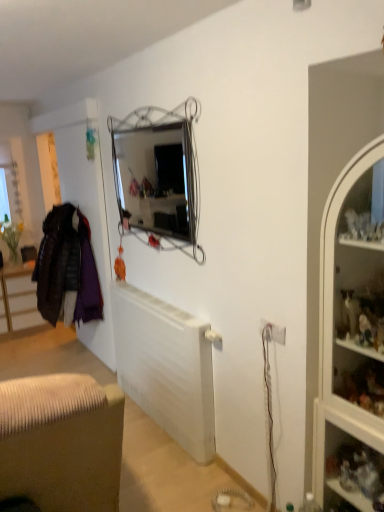
This screenshot has height=512, width=384. What do you see at coordinates (19, 297) in the screenshot?
I see `brown fabric cabinet at lower left` at bounding box center [19, 297].

The image size is (384, 512). What do you see at coordinates (351, 340) in the screenshot?
I see `white glass cabinet at right` at bounding box center [351, 340].

What is the approximate height of velvet purple coat at left?

1.01 meters.

Where is `brown fabric cabinet at lower left`? The height and width of the screenshot is (512, 384). brown fabric cabinet at lower left is located at coordinates click(x=19, y=297).

Is velvet purple coat at left turned away from white matte radiator at center?

No, velvet purple coat at left's orientation is not away from white matte radiator at center.

Does velvet purple coat at left have a greater width compared to white matte radiator at center?

Indeed, velvet purple coat at left has a greater width compared to white matte radiator at center.

Which object is further away from the camera taking this photo, velvet purple coat at left or white matte radiator at center?

velvet purple coat at left.

Where is `radiator directly beneath the velvet purple coat at left (from a real-world perspective)`? The image size is (384, 512). radiator directly beneath the velvet purple coat at left (from a real-world perspective) is located at coordinates (166, 366).

Considering the positions of objects white plastic electric outlet at lower right and clear glass shelves at right in the image provided, who is more to the right, white plastic electric outlet at lower right or clear glass shelves at right?

clear glass shelves at right is more to the right.

From the image's perspective, between white plastic electric outlet at lower right and clear glass shelves at right, who is located below?

clear glass shelves at right is shown below in the image.

Between white plastic electric outlet at lower right and clear glass shelves at right, which one has smaller size?

With smaller size is white plastic electric outlet at lower right.

Is white plastic electric outlet at lower right turned away from white matte radiator at center?

No, white plastic electric outlet at lower right is not facing away from white matte radiator at center.

Is point (266, 339) positioned after point (141, 294)?

No, it is in front of (141, 294).

From the picture: From the image's perspective, would you say white plastic electric outlet at lower right is positioned over white matte radiator at center?

Indeed, from the image's perspective, white plastic electric outlet at lower right is shown above white matte radiator at center.

Would you say white glass cabinet at right is outside clear glass shelves at right?

Yes, white glass cabinet at right is not within clear glass shelves at right.

From a real-world perspective, is white glass cabinet at right physically located above or below clear glass shelves at right?

white glass cabinet at right is above clear glass shelves at right.

Is the position of white glass cabinet at right more distant than that of clear glass shelves at right?

That is False.

Is white glass cabinet at right positioned with its back to clear glass shelves at right?

No, white glass cabinet at right is not facing away from clear glass shelves at right.

From the image's perspective, is clear glass shelves at right on white plastic electric outlet at lower right?

Incorrect, from the image's perspective, clear glass shelves at right is lower than white plastic electric outlet at lower right.

Between clear glass shelves at right and white plastic electric outlet at lower right, which one is positioned in front?

Positioned in front is clear glass shelves at right.

Between clear glass shelves at right and white plastic electric outlet at lower right, which one has smaller width?

Thinner between the two is white plastic electric outlet at lower right.

Which is in front, point (357, 483) or point (269, 327)?

The point (357, 483) is closer.

How different are the orientations of brown fabric cabinet at lower left and white glass cabinet at right in degrees?

The facing directions of brown fabric cabinet at lower left and white glass cabinet at right are 89.4 degrees apart.

From a real-world perspective, is brown fabric cabinet at lower left physically above white glass cabinet at right?

No.

Can you confirm if brown fabric cabinet at lower left is positioned to the right of white glass cabinet at right?

Incorrect, brown fabric cabinet at lower left is not on the right side of white glass cabinet at right.

The height and width of the screenshot is (512, 384). I want to click on cabinetry below the white glass cabinet at right (from the image's perspective), so click(x=19, y=297).

The image size is (384, 512). Identify the location of clothing lying above the white matte radiator at center (from the image's perspective). (67, 268).

Considering the positions of objects white matte radiator at center and velvet purple coat at left in the image provided, who is more to the left, white matte radiator at center or velvet purple coat at left?

Positioned to the left is velvet purple coat at left.

In the scene shown: Is white matte radiator at center far from velvet purple coat at left?

Actually, white matte radiator at center and velvet purple coat at left are a little close together.

From a real-world perspective, is white matte radiator at center positioned above or below velvet purple coat at left?

In terms of real-world spatial position, white matte radiator at center is below velvet purple coat at left.

The height and width of the screenshot is (512, 384). Identify the location of radiator located in front of the velvet purple coat at left. (166, 366).

Where is `electric outlet above the clear glass shelves at right (from a real-world perspective)`? This screenshot has height=512, width=384. electric outlet above the clear glass shelves at right (from a real-world perspective) is located at coordinates (273, 332).

Estimate the real-world distances between objects in this image. Which object is further from white matte radiator at center, velvet purple coat at left or white glass cabinet at right?

white glass cabinet at right.

Consider the image. When comparing their distances from white glass cabinet at right, does white plastic electric outlet at lower right or white matte radiator at center seem further?

The object further to white glass cabinet at right is white matte radiator at center.

Which object lies further to the anchor point white plastic electric outlet at lower right, clear glass shelves at right or white glass cabinet at right?

The object further to white plastic electric outlet at lower right is clear glass shelves at right.

Estimate the real-world distances between objects in this image. Which object is closer to white plastic electric outlet at lower right, brown fabric cabinet at lower left or white matte radiator at center?

white matte radiator at center is closer to white plastic electric outlet at lower right.

Which object lies further to the anchor point brown fabric cabinet at lower left, clear glass shelves at right or white matte radiator at center?

clear glass shelves at right is further to brown fabric cabinet at lower left.

Which object lies nearer to the anchor point white plastic electric outlet at lower right, clear glass shelves at right or velvet purple coat at left?

clear glass shelves at right.

When comparing their distances from clear glass shelves at right, does white matte radiator at center or white glass cabinet at right seem closer?

white glass cabinet at right is closer to clear glass shelves at right.

Which object lies further to the anchor point white plastic electric outlet at lower right, velvet purple coat at left or white matte radiator at center?

Among the two, velvet purple coat at left is located further to white plastic electric outlet at lower right.

Where is `shelf between white glass cabinet at right and brown fabric cabinet at lower left in the front-back direction`? This screenshot has width=384, height=512. shelf between white glass cabinet at right and brown fabric cabinet at lower left in the front-back direction is located at coordinates (351, 473).

Where is `clothing between white plastic electric outlet at lower right and brown fabric cabinet at lower left from front to back`? The width and height of the screenshot is (384, 512). clothing between white plastic electric outlet at lower right and brown fabric cabinet at lower left from front to back is located at coordinates (67, 268).

Identify the location of cabinet between velvet purple coat at left and clear glass shelves at right from left to right. (351, 340).

Image resolution: width=384 pixels, height=512 pixels. In order to click on electric outlet positioned between white glass cabinet at right and brown fabric cabinet at lower left from near to far in this screenshot , I will do `click(273, 332)`.